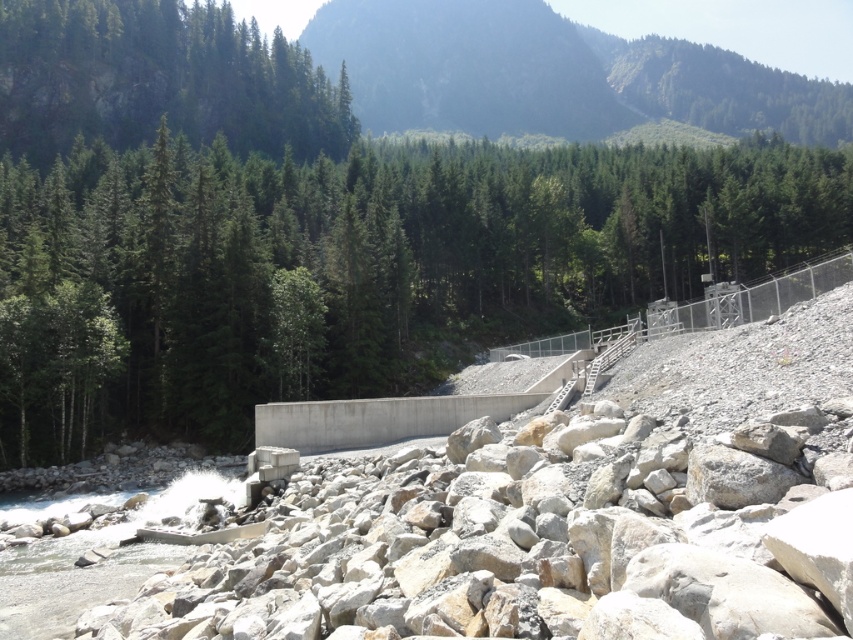
Who is positioned more to the right, green matte tree at upper center or green forested mountain at upper center?

From the viewer's perspective, green forested mountain at upper center appears more on the right side.

Find the location of a particular element. Image resolution: width=853 pixels, height=640 pixels. green matte tree at upper center is located at coordinates (352, 268).

Which is more to the left, green forested mountain at upper center or green matte tree at upper left?

green matte tree at upper left

Which of these two, green forested mountain at upper center or green matte tree at upper left, stands shorter?

Standing shorter between the two is green matte tree at upper left.

Find the location of `green forested mountain at upper center`. green forested mountain at upper center is located at coordinates (553, 74).

Which is below, green matte tree at upper center or green matte tree at upper left?

Positioned lower is green matte tree at upper center.

Does point (151, 202) lie behind point (306, 148)?

No, it is in front of (306, 148).

This screenshot has width=853, height=640. What are the coordinates of `green matte tree at upper center` in the screenshot? It's located at (352, 268).